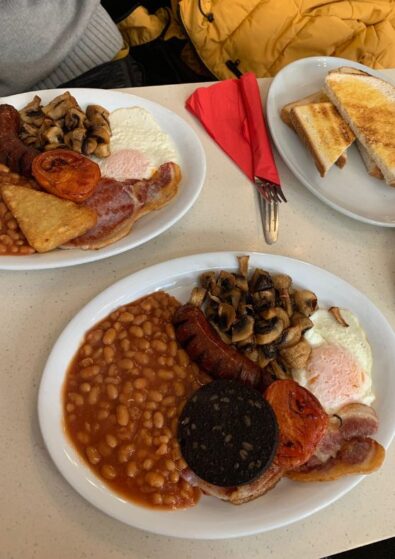
I want to click on plate, so click(x=339, y=286).